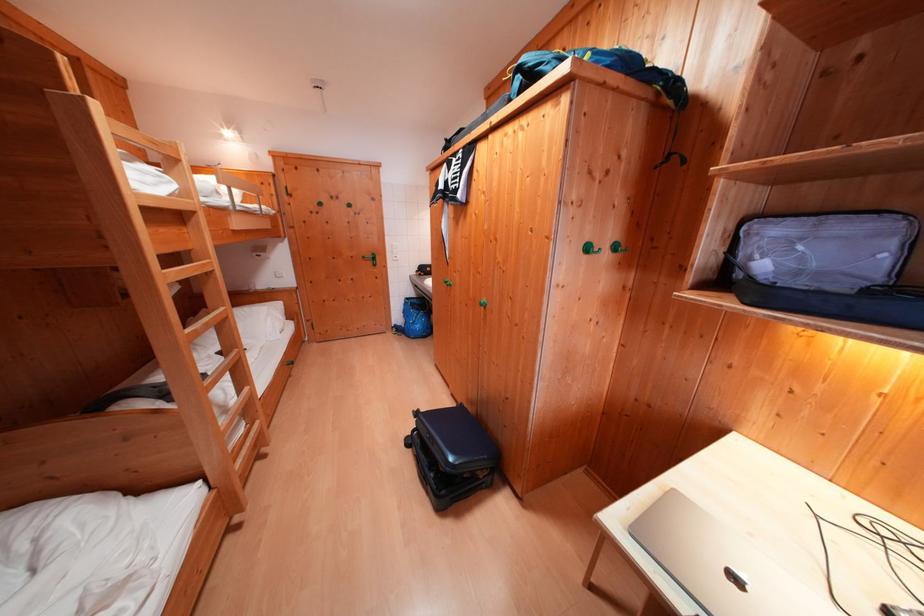
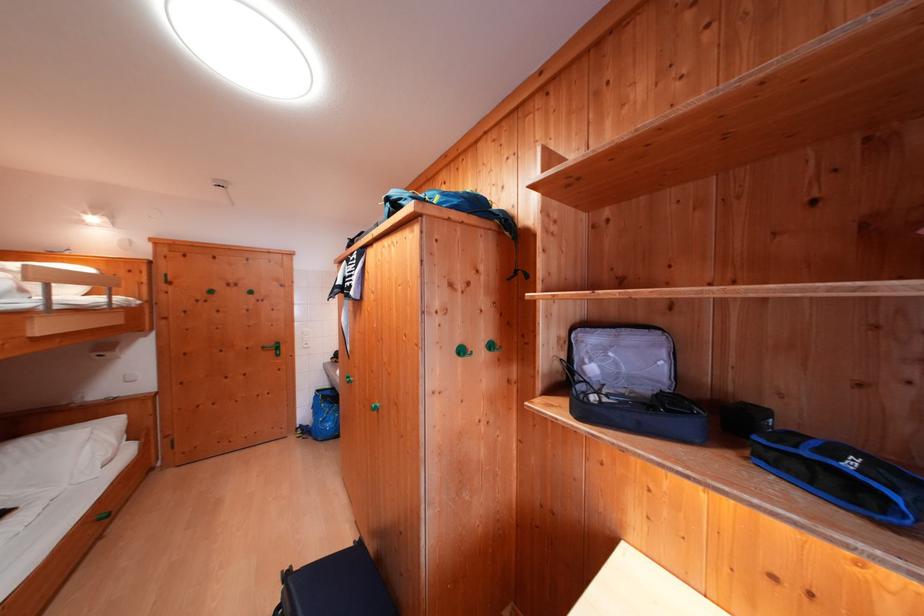
Locate, in the second image, the point that corresponds to (808,252) in the first image.

(619, 359)